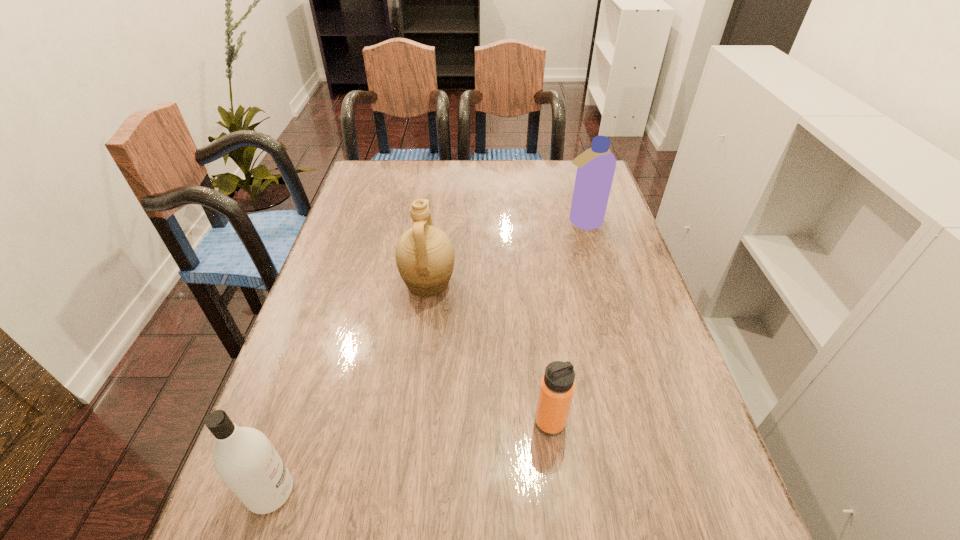
Find the location of a particular element. free space in the image that satisfies the following two spatial constraints: 1. on the front side of the shortest object; 2. on the front-facing side of the nearer shampoo is located at coordinates (x=559, y=492).

Locate an element on the screen. vacant area in the image that satisfies the following two spatial constraints: 1. on the front side of the thermos bottle; 2. on the front-facing side of the nearer shampoo is located at coordinates (559, 492).

Find the location of `free spot that satisfies the following two spatial constraints: 1. on the back side of the third object from right to left; 2. on the right side of the farther shampoo`. free spot that satisfies the following two spatial constraints: 1. on the back side of the third object from right to left; 2. on the right side of the farther shampoo is located at coordinates (436, 222).

Identify the location of free region that satisfies the following two spatial constraints: 1. on the back side of the third farthest object; 2. on the right side of the farthest object. (525, 222).

I want to click on vacant space that satisfies the following two spatial constraints: 1. on the front side of the pitcher; 2. on the front-facing side of the left shampoo, so point(402,492).

Locate an element on the screen. This screenshot has width=960, height=540. vacant area that satisfies the following two spatial constraints: 1. on the back side of the second object from left to right; 2. on the right side of the farther shampoo is located at coordinates (436, 222).